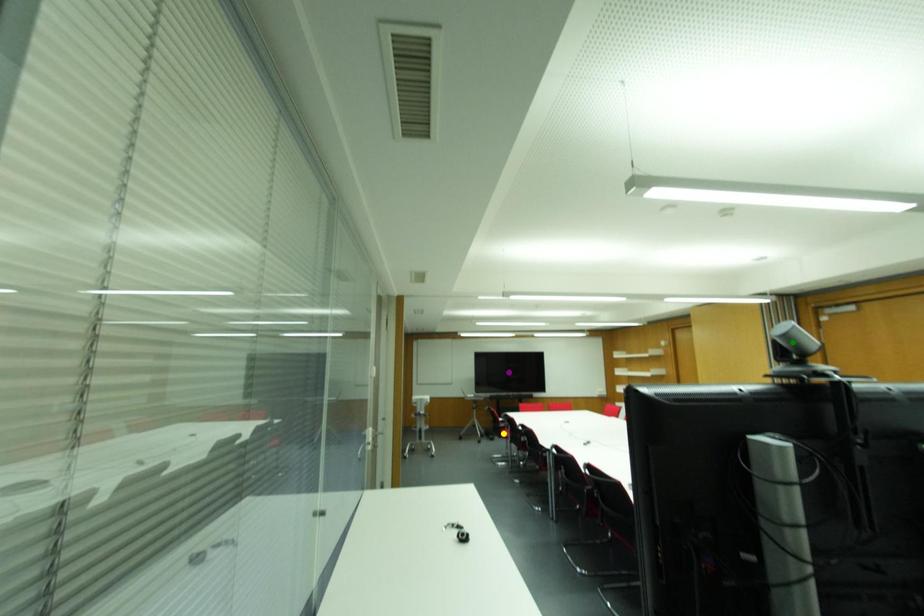
Order these from nearest to farthest:
green point, purple point, yellow point

green point → yellow point → purple point